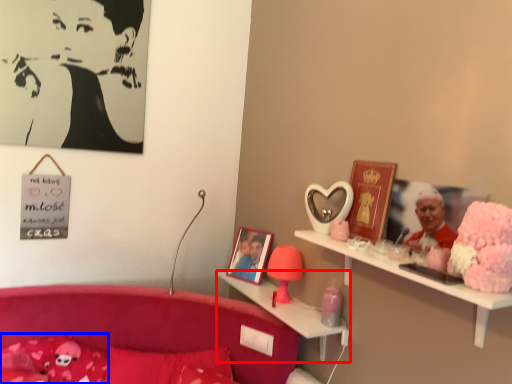
Question: Which object is further to the camera taking this photo, shelf (highlighted by a red box) or pillow (highlighted by a blue box)?

Choices:
 (A) shelf
 (B) pillow

Answer: (A)